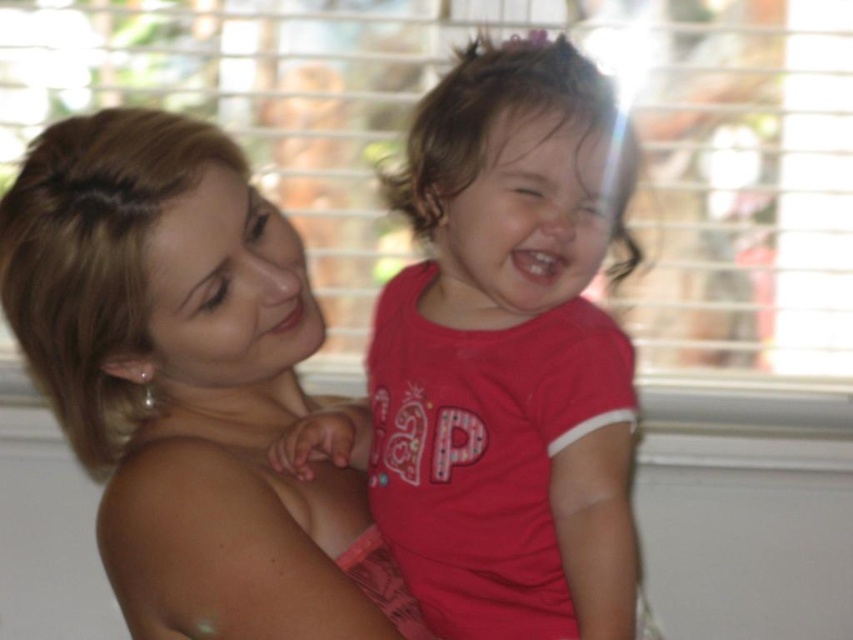
Question: Does pink matte shirt at center appear on the right side of smooth blonde hair at left?

Choices:
 (A) no
 (B) yes

Answer: (B)

Question: Does pink matte shirt at center have a larger size compared to smooth blonde hair at left?

Choices:
 (A) no
 (B) yes

Answer: (B)

Question: Among these points, which one is farthest from the camera?

Choices:
 (A) (300, 285)
 (B) (375, 465)

Answer: (B)

Question: Observing the image, what is the correct spatial positioning of pink matte shirt at center in reference to smooth blonde hair at left?

Choices:
 (A) left
 (B) right

Answer: (B)

Question: Which point appears closest to the camera in this image?

Choices:
 (A) (546, 333)
 (B) (222, 442)

Answer: (A)